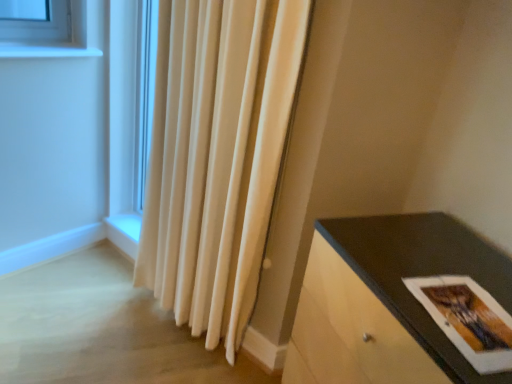
This screenshot has width=512, height=384. I want to click on vacant area situated to the left side of white velvet curtain at center, so click(136, 340).